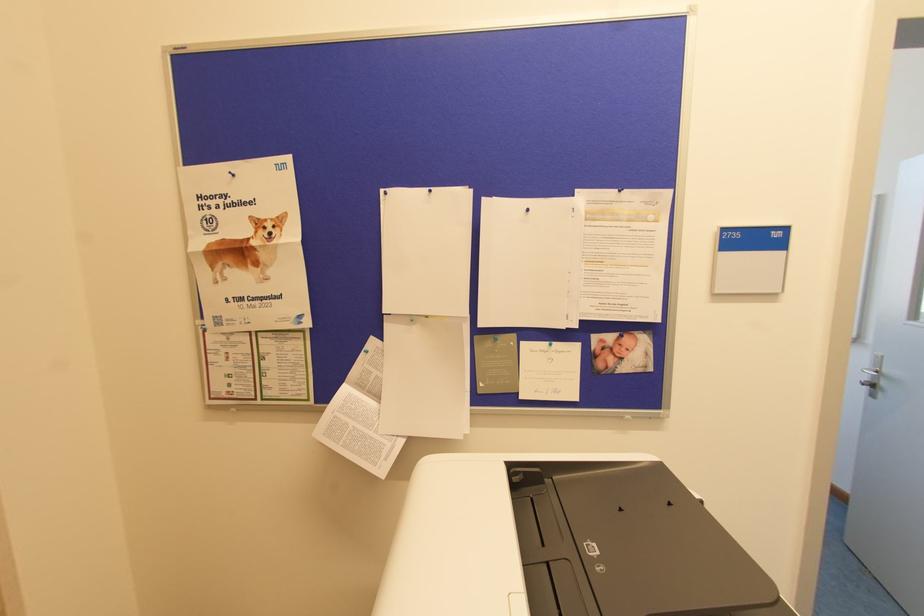
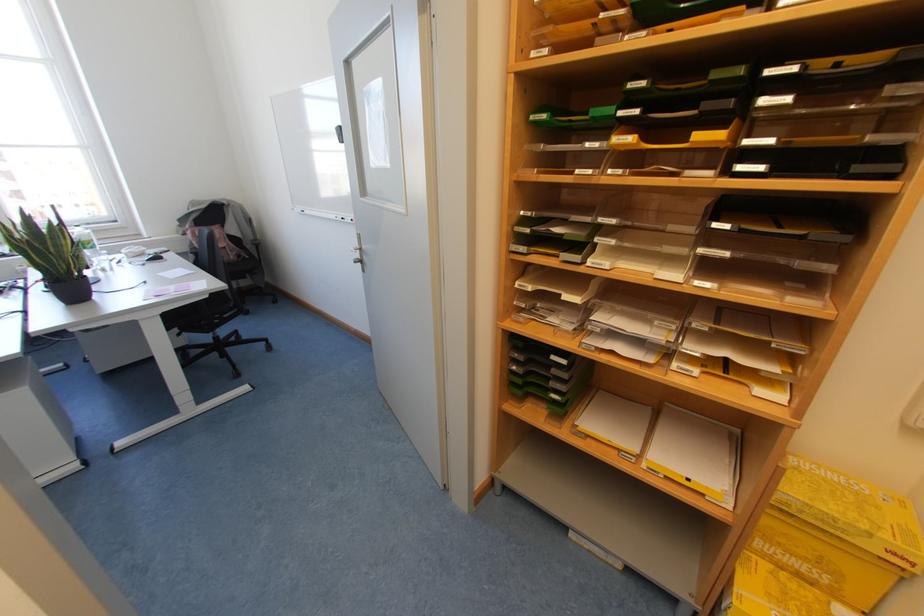
In the second image, find the point that corresponds to point (868, 382) in the first image.

(358, 259)